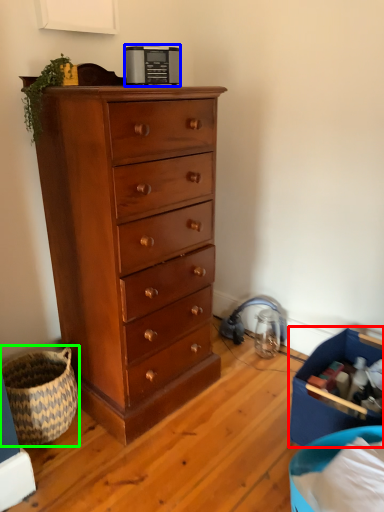
Question: Considering the real-world distances, which object is closest to storage box (highlighted by a red box)? appliance (highlighted by a blue box) or basket (highlighted by a green box).

Choices:
 (A) appliance
 (B) basket

Answer: (B)